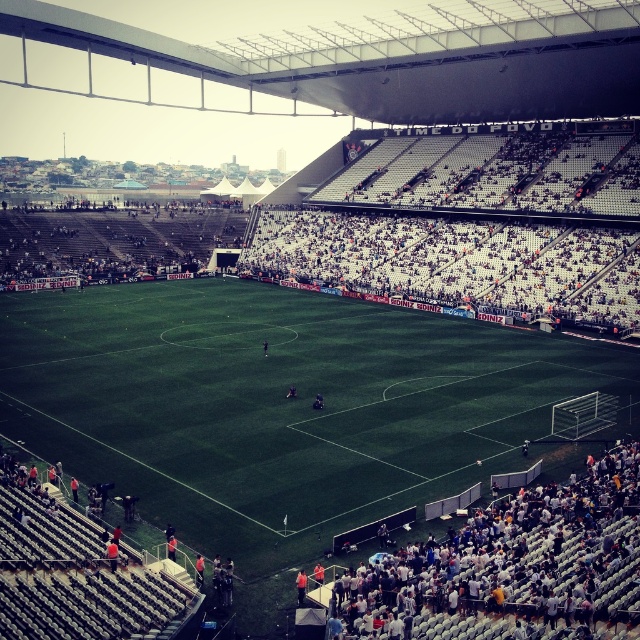
You are a drone operator trying to capture aerial shots of the soccer stadium. You have two points marked on your screen, point (93, 456) and point (506, 554). If you want to fly the drone closer to the first point, which point should you prioritize adjusting your camera angle towards?

Point (93, 456) is further to the viewer than point (506, 554), so to fly the drone closer to the first point, you should adjust your camera angle towards point (93, 456).